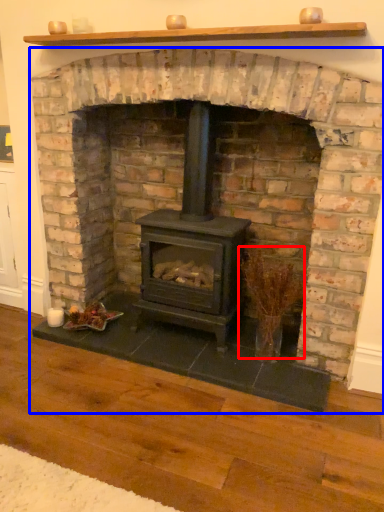
Question: Which object is closer to the camera taking this photo, twig (highlighted by a red box) or fireplace (highlighted by a blue box)?

Choices:
 (A) twig
 (B) fireplace

Answer: (B)